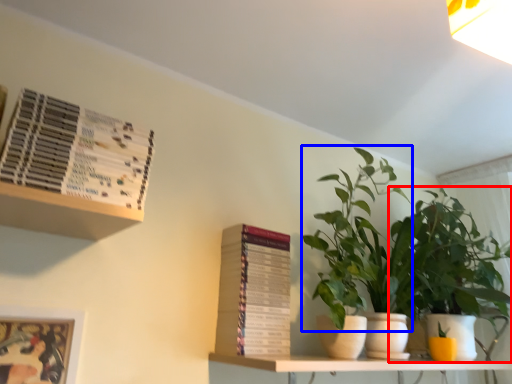
Question: Among these objects, which one is nearest to the camera, houseplant (highlighted by a red box) or vegetation (highlighted by a blue box)?

Choices:
 (A) houseplant
 (B) vegetation

Answer: (B)